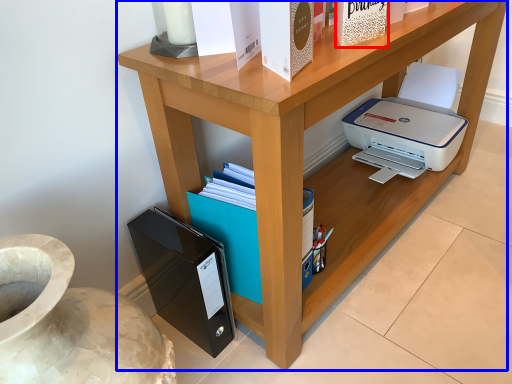
Question: Which point is further to the camera, paperback book (highlighted by a red box) or desk (highlighted by a blue box)?

Choices:
 (A) paperback book
 (B) desk

Answer: (A)